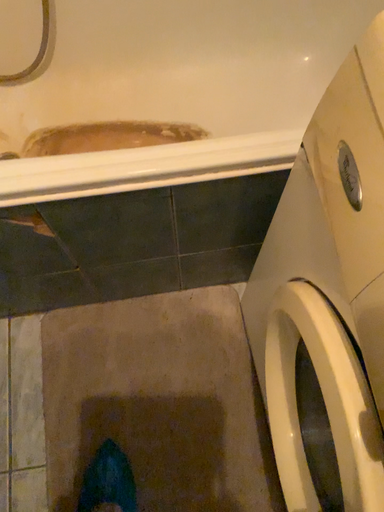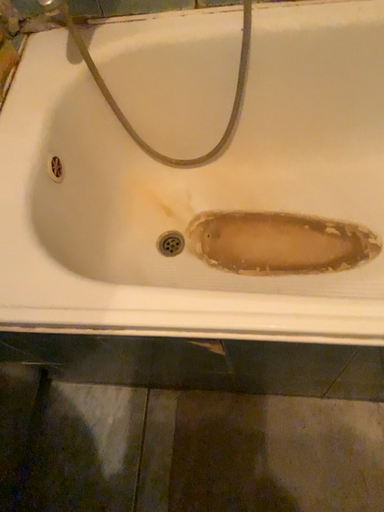
Question: How did the camera likely rotate when shooting the video?

Choices:
 (A) rotated right
 (B) rotated left

Answer: (B)